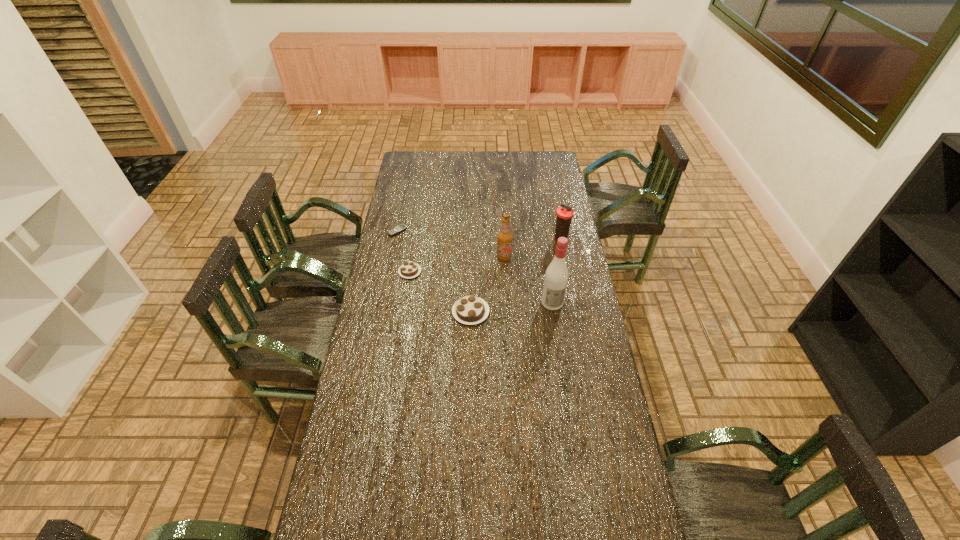
Image resolution: width=960 pixels, height=540 pixels. Identify the location of the fourth farthest object. (409, 269).

Find the location of `the shorter chocolate cake`. the shorter chocolate cake is located at coordinates (409, 269).

The height and width of the screenshot is (540, 960). In order to click on the nearer chocolate cake in this screenshot , I will do `click(470, 310)`.

Locate an element on the screen. the right chocolate cake is located at coordinates (470, 310).

Locate an element on the screen. The width and height of the screenshot is (960, 540). the rightmost object is located at coordinates (564, 213).

The image size is (960, 540). I want to click on thermos bottle, so click(x=564, y=213).

Where is `beer bottle`? beer bottle is located at coordinates (504, 237).

This screenshot has height=540, width=960. Find the location of `the third object from right to left`. the third object from right to left is located at coordinates (504, 237).

Locate an element on the screen. Image resolution: width=960 pixels, height=540 pixels. the shortest object is located at coordinates (402, 227).

You are a GUI agent. You are given a task and a screenshot of the screen. Output one action in this format:
    pyautogui.click(x=<x>, y=<y>)
    Task: Click on the alcohol
    The image size is (960, 540).
    Given the screenshot: What is the action you would take?
    (556, 276)